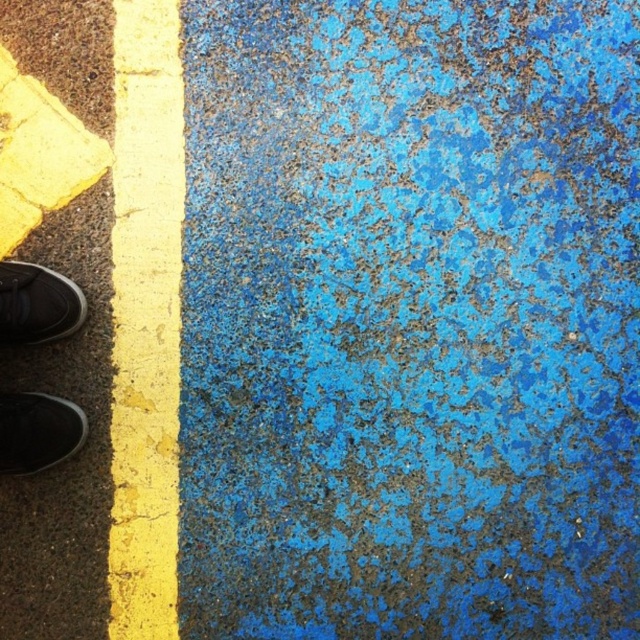
Can you confirm if matte black shoe at lower left is shorter than black suede shoe at lower left?

Indeed, matte black shoe at lower left has a lesser height compared to black suede shoe at lower left.

Does matte black shoe at lower left appear under black suede shoe at lower left?

Correct, matte black shoe at lower left is located below black suede shoe at lower left.

Does point (80, 442) come closer to viewer compared to point (17, 310)?

No.

Locate an element on the screen. This screenshot has height=640, width=640. matte black shoe at lower left is located at coordinates (36, 432).

Is yellow painted line at left taller than matte black shoe at lower left?

Indeed, yellow painted line at left has a greater height compared to matte black shoe at lower left.

Does yellow painted line at left appear on the left side of matte black shoe at lower left?

No, yellow painted line at left is not to the left of matte black shoe at lower left.

Where is `yellow painted line at left`? The height and width of the screenshot is (640, 640). yellow painted line at left is located at coordinates (145, 317).

Find the location of a particular element. The height and width of the screenshot is (640, 640). yellow painted line at left is located at coordinates point(145,317).

Is yellow painted line at left in front of black suede shoe at lower left?

No, it is behind black suede shoe at lower left.

Based on the photo, can you confirm if yellow painted line at left is thinner than black suede shoe at lower left?

Yes.

Based on the photo, measure the distance between yellow painted line at left and camera.

5.96 feet

The width and height of the screenshot is (640, 640). Identify the location of yellow painted line at left. (145, 317).